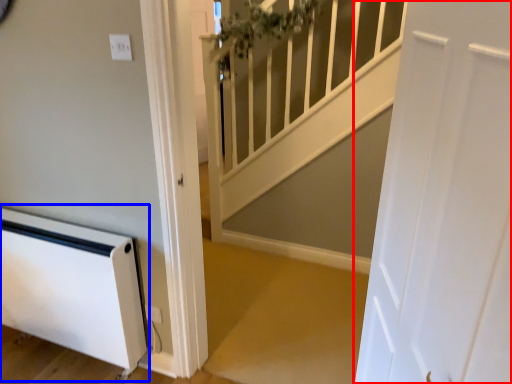
Question: Which point is further to the camera, door (highlighted by a red box) or appliance (highlighted by a blue box)?

Choices:
 (A) door
 (B) appliance

Answer: (B)